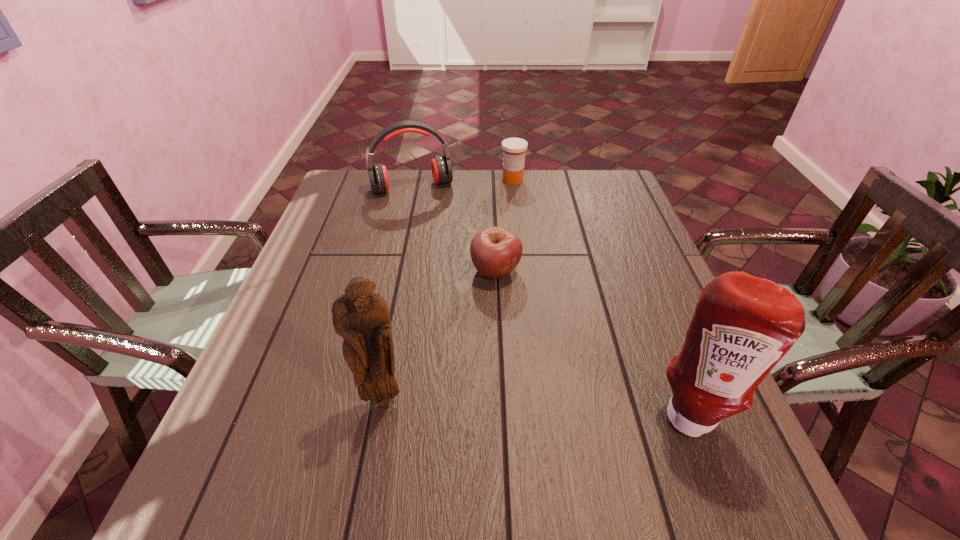
At what (x,y) coordinates should I click in order to perform the action: click on condiment present at the near edge. Please return your answer as a coordinate pair (x, y). Image resolution: width=960 pixels, height=540 pixels. Looking at the image, I should click on (743, 325).

Find the location of a particular element. This screenshot has width=960, height=540. object present at the left edge is located at coordinates (441, 167).

Where is `object present at the right edge`? object present at the right edge is located at coordinates (743, 325).

Where is `object that is at the far left corner`? The image size is (960, 540). object that is at the far left corner is located at coordinates (441, 167).

This screenshot has height=540, width=960. I want to click on object located at the near right corner, so click(743, 325).

In the image, there is a desktop. At what (x,y) coordinates should I click in order to perform the action: click on free space at the far edge. Please return your answer as a coordinate pair (x, y). The height and width of the screenshot is (540, 960). Looking at the image, I should click on (461, 187).

Image resolution: width=960 pixels, height=540 pixels. What are the coordinates of `free spot at the left edge of the desktop` in the screenshot? It's located at (372, 222).

Find the location of a particular element. vacant space at the right edge of the desktop is located at coordinates (635, 316).

The width and height of the screenshot is (960, 540). Identify the location of vacant area at the near left corner of the desktop. pyautogui.click(x=237, y=412).

Locate an element on the screen. The height and width of the screenshot is (540, 960). free space at the far right corner of the desktop is located at coordinates click(582, 190).